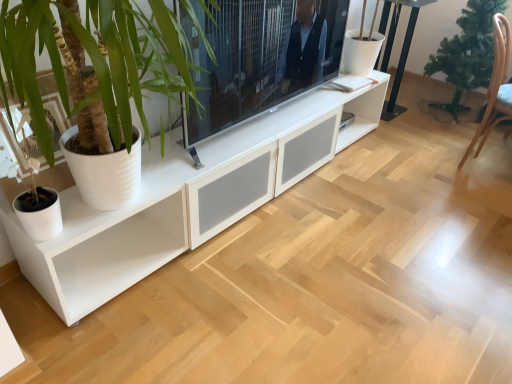
This screenshot has height=384, width=512. What are the coordinates of `free location in front of brown wooden armchair at right` in the screenshot? It's located at (481, 192).